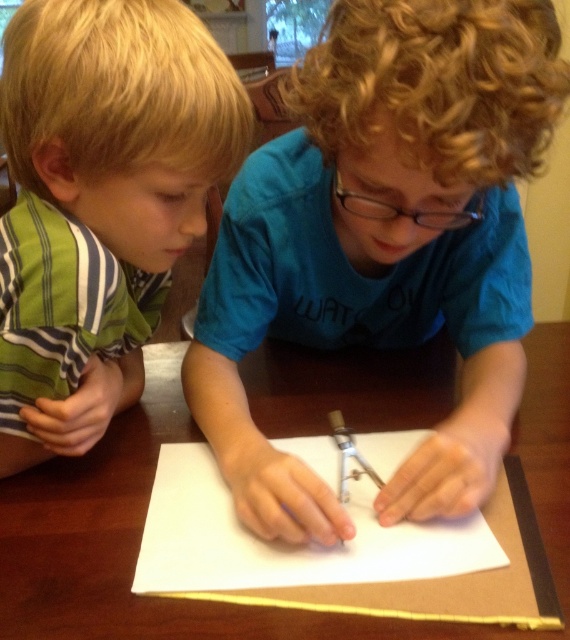
Question: Can you confirm if white paper at center is smaller than metallic silver compass at center?

Choices:
 (A) yes
 (B) no

Answer: (B)

Question: Is green striped shirt at left positioned at the back of white paper at center?

Choices:
 (A) yes
 (B) no

Answer: (B)

Question: Which object is the farthest from the brown wooden table at center?

Choices:
 (A) blue matte shirt at center
 (B) green striped shirt at left
 (C) white paper at center

Answer: (B)

Question: Which object is positioned closest to the green striped shirt at left?

Choices:
 (A) blue matte shirt at center
 (B) brown wooden table at center

Answer: (A)

Question: Which of these objects is positioned farthest from the green striped shirt at left?

Choices:
 (A) blue matte shirt at center
 (B) white paper at center

Answer: (B)

Question: Observing the image, what is the correct spatial positioning of brown wooden table at center in reference to white paper at center?

Choices:
 (A) above
 (B) below

Answer: (A)